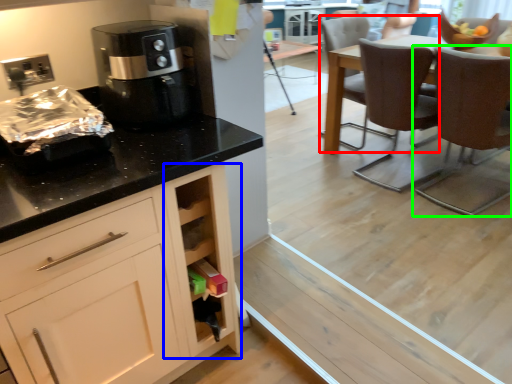
Question: Which object is the closest to the chair (highlighted by a red box)? Choose among these: cabinetry (highlighted by a blue box) or chair (highlighted by a green box).

Choices:
 (A) cabinetry
 (B) chair

Answer: (B)